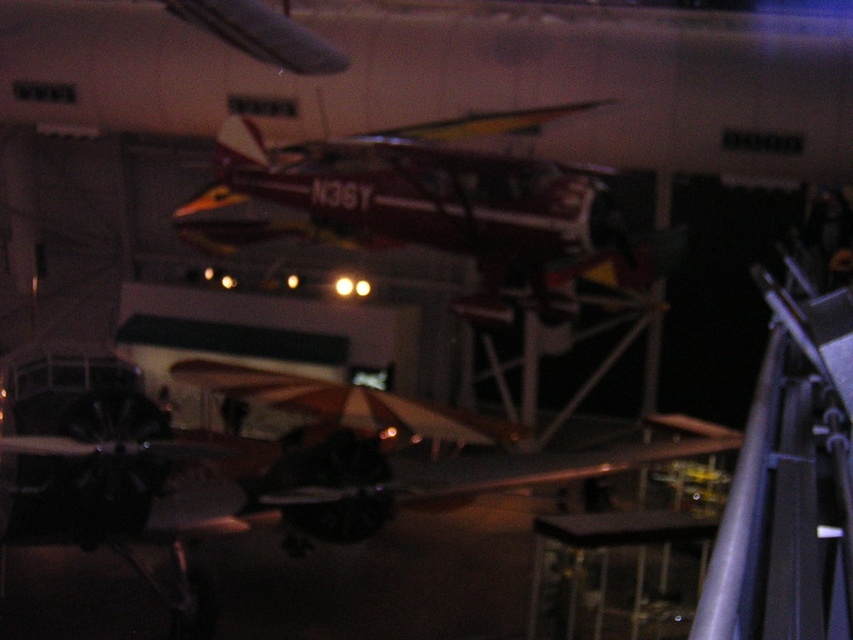
Which is below, shiny silver airplane at center or shiny metallic airplane at center?

shiny silver airplane at center

Which is in front, point (0, 493) or point (488, 179)?

Positioned in front is point (0, 493).

Identify the location of shiny silver airplane at center. (244, 484).